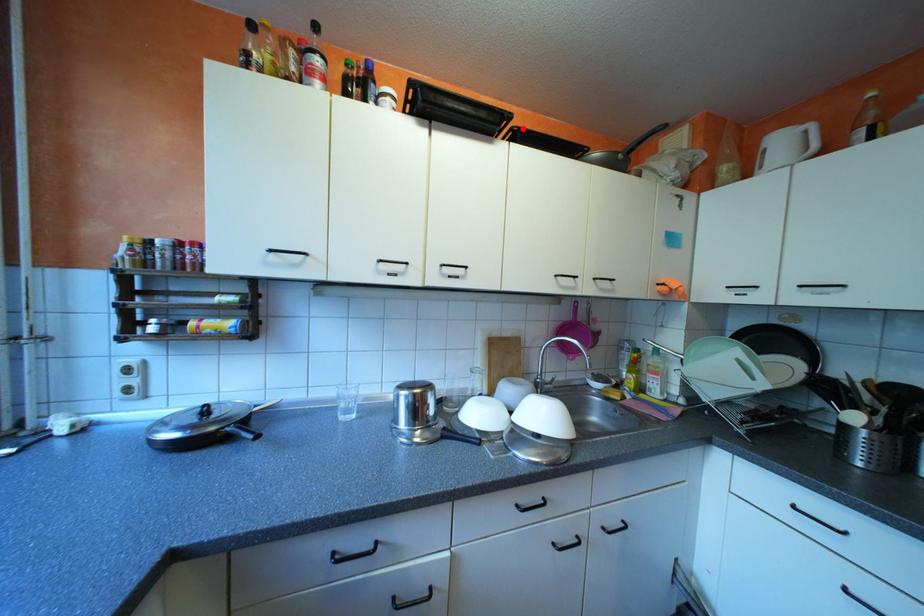
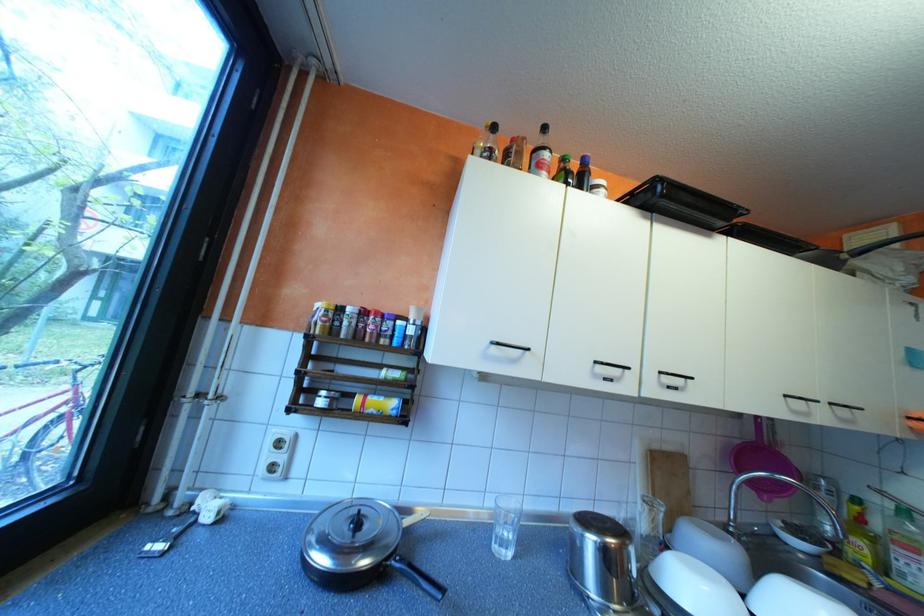
Find the pixel in the second image that matches the highlighted location in the first image.

(745, 224)